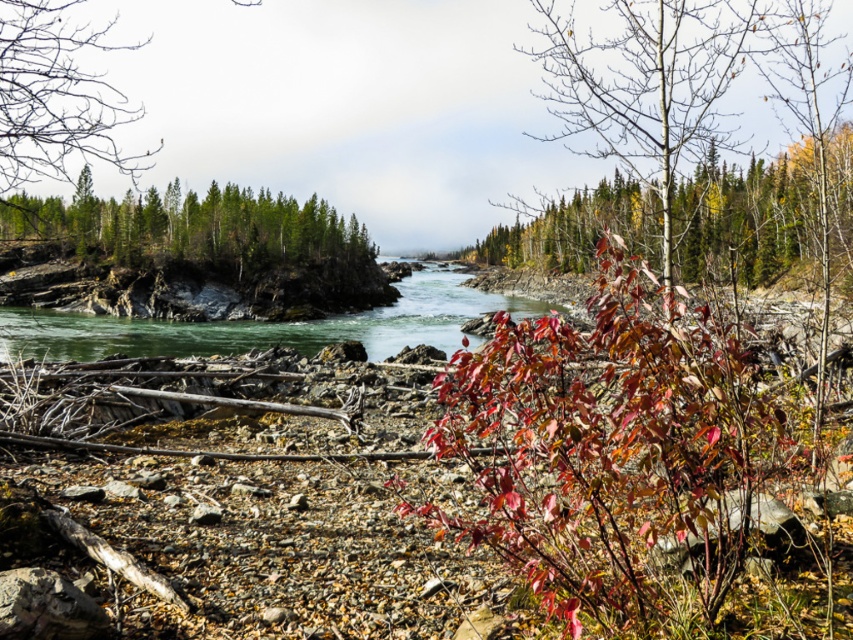
Question: Does leaves at upper right have a smaller size compared to green matte trees at upper center?

Choices:
 (A) no
 (B) yes

Answer: (A)

Question: Which point is farther to the camera?

Choices:
 (A) green matte trees at upper center
 (B) leaves at upper right
 (C) green smooth water at center

Answer: (C)

Question: Which object is positioned closest to the green matte trees at upper center?

Choices:
 (A) green smooth water at center
 (B) leaves at upper right

Answer: (A)

Question: Is leaves at upper right to the left of green matte trees at upper center from the viewer's perspective?

Choices:
 (A) yes
 (B) no

Answer: (B)

Question: Is leaves at upper right below green smooth water at center?

Choices:
 (A) yes
 (B) no

Answer: (B)

Question: Which object is closer to the camera taking this photo?

Choices:
 (A) green matte trees at upper center
 (B) green smooth water at center

Answer: (A)